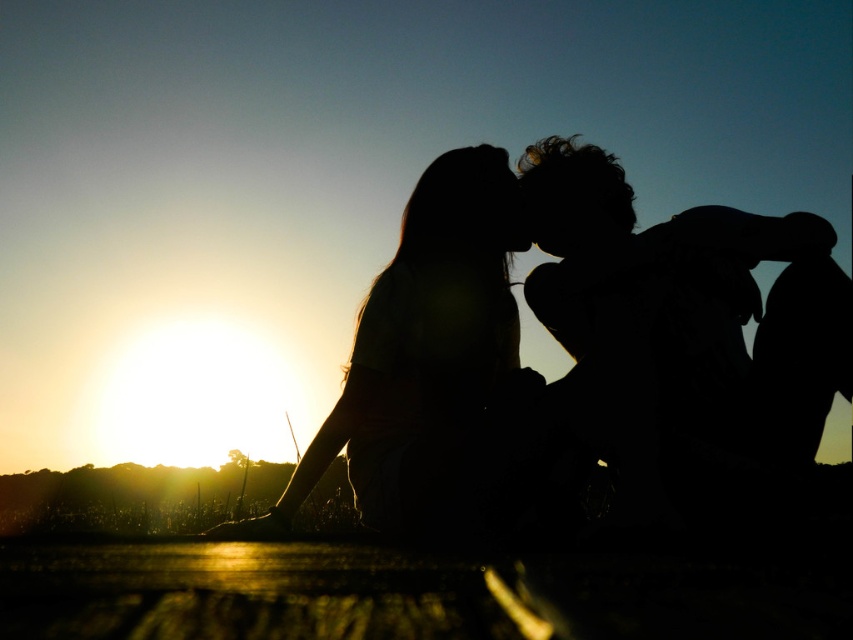
Between silhouette hair at right and silhouette hair at center, which one is positioned lower?

Positioned lower is silhouette hair at center.

Does silhouette hair at right have a greater height compared to silhouette hair at center?

No.

The width and height of the screenshot is (853, 640). I want to click on silhouette hair at right, so click(x=689, y=339).

At what (x,y) coordinates should I click in order to perform the action: click on silhouette hair at right. Please return your answer as a coordinate pair (x, y). This screenshot has width=853, height=640. Looking at the image, I should click on (689, 339).